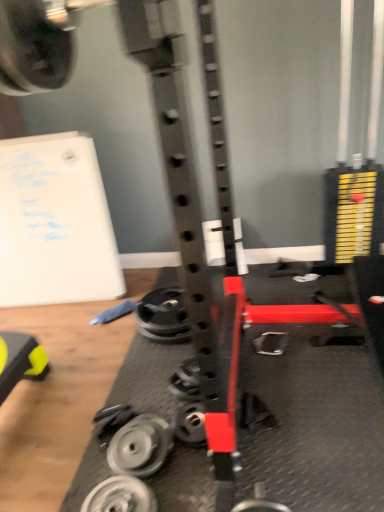
Locate an element on the screen. free space to the left of silver metallic weight at center-left, which is the second wheel from bottom to top is located at coordinates (78, 464).